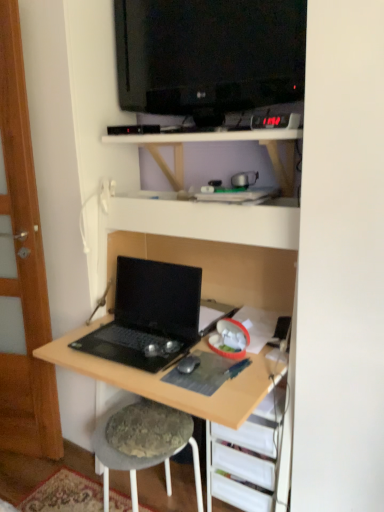
Where is `vacant area that is in front of black matte mouse at center`? Image resolution: width=384 pixels, height=512 pixels. vacant area that is in front of black matte mouse at center is located at coordinates (195, 383).